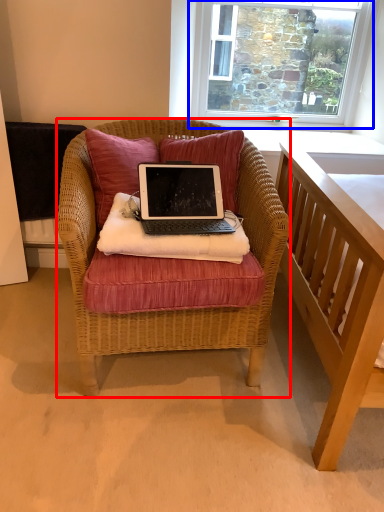
Question: Among these objects, which one is nearest to the camera, chair (highlighted by a red box) or window (highlighted by a blue box)?

Choices:
 (A) chair
 (B) window

Answer: (A)